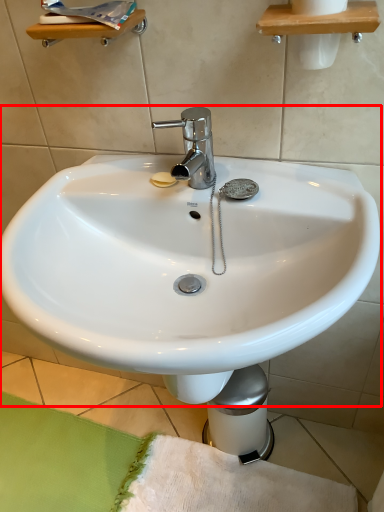
Question: Considering the relative positions of sink (annotated by the red box) and bath mat in the image provided, where is sink (annotated by the red box) located with respect to the staircase?

Choices:
 (A) left
 (B) right

Answer: (B)